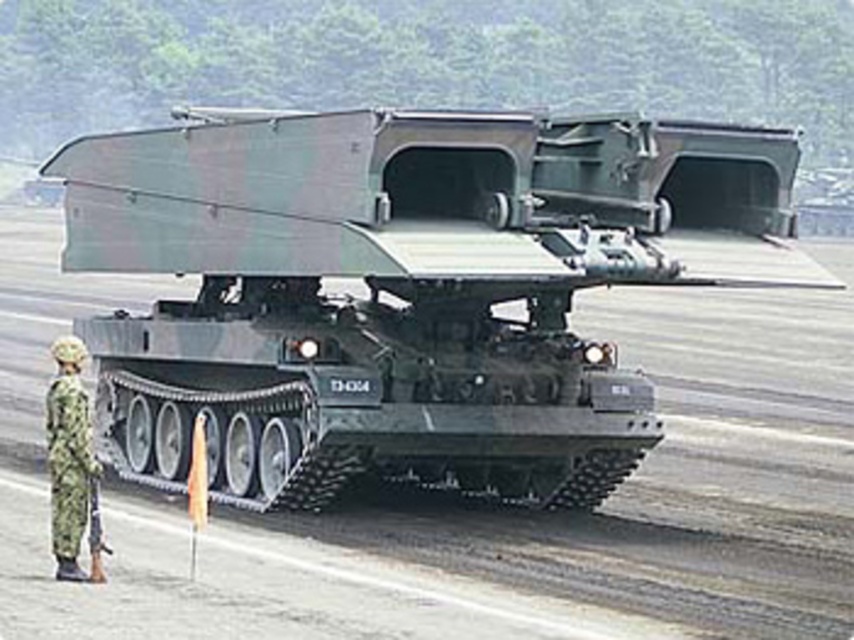
You are a military personnel who needs to store both the camouflage matte tank at center and the camouflage fabric uniform at lower left in a vertical locker. Given their sizes, which one do you think will require more vertical space?

The camouflage matte tank at center requires more vertical space because it has a greater height than the camouflage fabric uniform at lower left.

You are a military engineer tasked with moving the camouflage fabric uniform at lower left to a safe distance from the camouflage matte tank at center. The minimum safe distance required is 5 meters. Is the current distance sufficient?

The camouflage matte tank at center is 5.46 meters away from the camouflage fabric uniform at lower left. Since the minimum safe distance required is 5 meters, the current distance is sufficient.